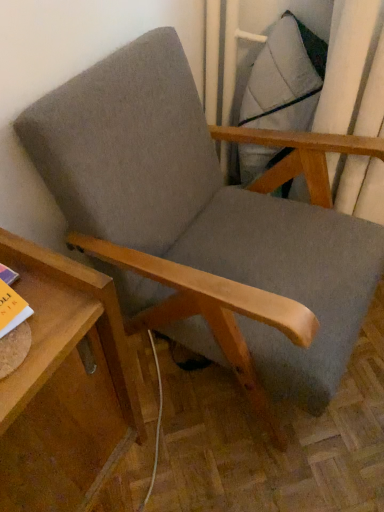
Where is `gray fabric swivel chair at upper right`? This screenshot has width=384, height=512. gray fabric swivel chair at upper right is located at coordinates (285, 78).

In order to face gray fabric swivel chair at upper right, should I rotate leftwards or rightwards?

To face it directly, rotate right by 11.826 degrees.

Describe the element at coordinates (285, 78) in the screenshot. I see `gray fabric swivel chair at upper right` at that location.

The image size is (384, 512). What are the coordinates of `gray fabric swivel chair at upper right` in the screenshot? It's located at (285, 78).